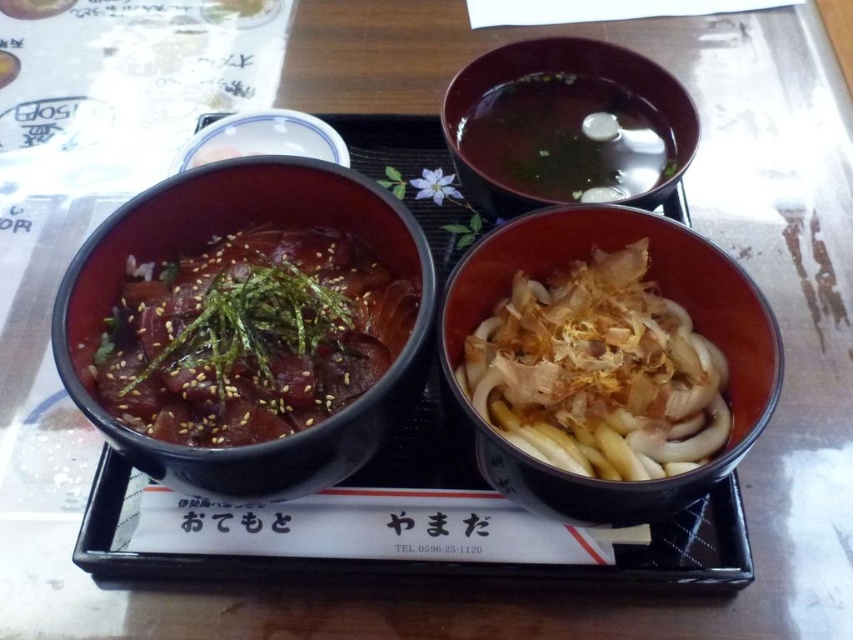
Question: Which is nearer to the matte brown bowl at center?

Choices:
 (A) matte ceramic bowl at upper center
 (B) matte black bowl at left

Answer: (B)

Question: Can you confirm if matte black bowl at left is positioned below matte brown bowl at center?

Choices:
 (A) yes
 (B) no

Answer: (B)

Question: Is matte black bowl at left below matte brown bowl at center?

Choices:
 (A) no
 (B) yes

Answer: (A)

Question: Which object is farther from the camera taking this photo?

Choices:
 (A) matte ceramic bowl at upper center
 (B) brown glossy bowl at upper center
 (C) matte brown bowl at center
 (D) matte black bowl at left

Answer: (A)

Question: Observing the image, what is the correct spatial positioning of brown glossy bowl at upper center in reference to matte ceramic bowl at upper center?

Choices:
 (A) above
 (B) below

Answer: (B)

Question: Among these points, which one is farthest from the camera?

Choices:
 (A) (643, 506)
 (B) (231, 156)

Answer: (B)